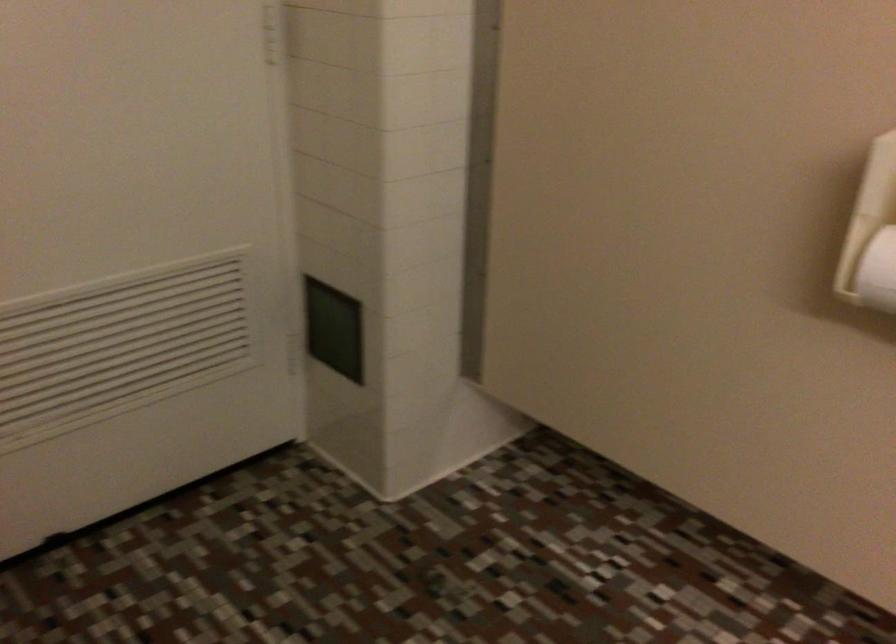
Find where to open the small black panel. Please return your answer as a coordinate pair (x, y).

(334, 328)